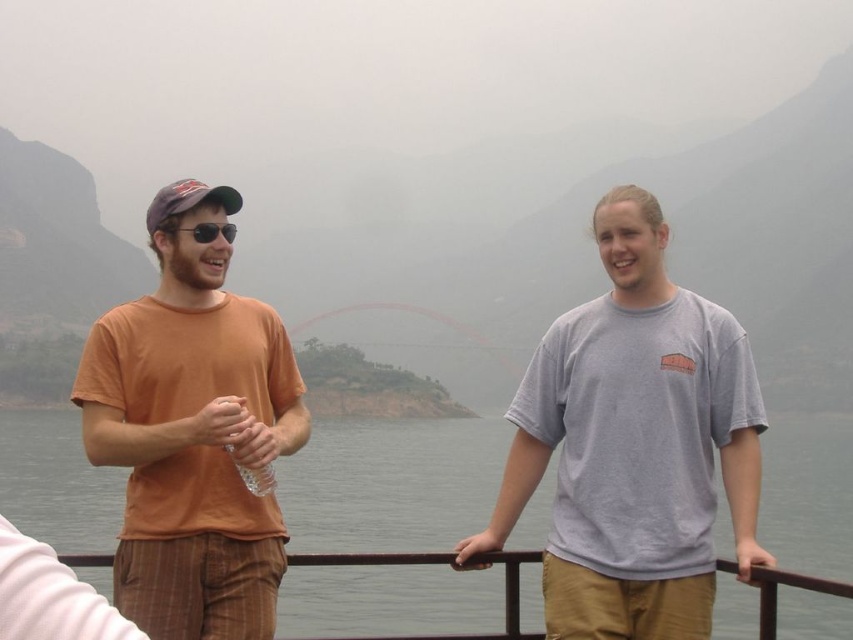
Who is positioned more to the left, metallic brown railing at center or black plastic sunglasses at center?

black plastic sunglasses at center is more to the left.

Describe the element at coordinates (503, 600) in the screenshot. Image resolution: width=853 pixels, height=640 pixels. I see `metallic brown railing at center` at that location.

Image resolution: width=853 pixels, height=640 pixels. I want to click on metallic brown railing at center, so click(503, 600).

Does transparent water at center have a lesser width compared to gray cotton t-shirt at center?

No, transparent water at center is not thinner than gray cotton t-shirt at center.

Is transparent water at center to the right of gray cotton t-shirt at center from the viewer's perspective?

Incorrect, transparent water at center is not on the right side of gray cotton t-shirt at center.

Does point (347, 474) lie in front of point (582, 406)?

No, it is not.

Where is `transparent water at center`? This screenshot has height=640, width=853. transparent water at center is located at coordinates (392, 484).

Who is lower down, orange cotton t-shirt at left or metallic brown railing at center?

metallic brown railing at center is below.

Based on the photo, can you confirm if orange cotton t-shirt at left is positioned above metallic brown railing at center?

Correct, orange cotton t-shirt at left is located above metallic brown railing at center.

Describe the element at coordinates (193, 433) in the screenshot. I see `orange cotton t-shirt at left` at that location.

The image size is (853, 640). Identify the location of orange cotton t-shirt at left. (193, 433).